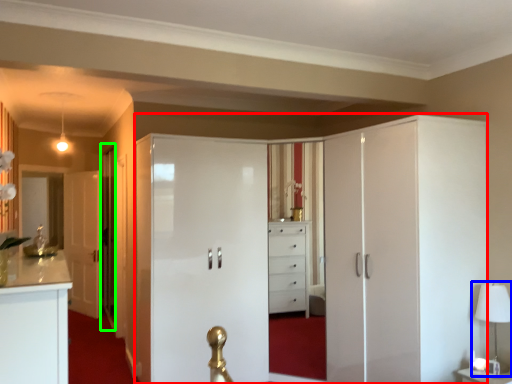
Question: Which object is the farthest from dresser (highlighted by a red box)? Choose among these: table lamp (highlighted by a blue box) or glass door (highlighted by a green box).

Choices:
 (A) table lamp
 (B) glass door

Answer: (B)